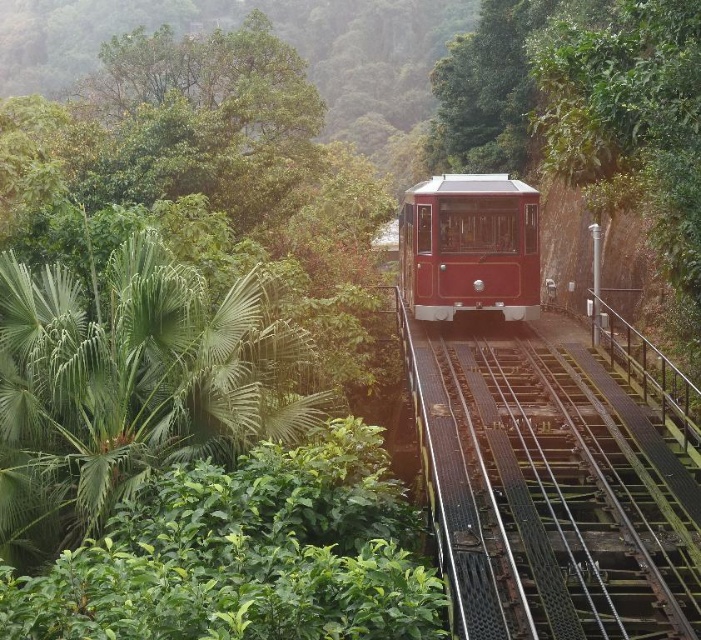
You are a railway engineer inspecting the shiny red tram at center and the black metal train track at center. Based on their sizes, which one do you think is more likely to require immediate maintenance due to wear and tear?

The black metal train track at center has a smaller size compared to the shiny red tram at center, so it might require immediate maintenance due to wear and tear because smaller tracks can experience more stress and wear under the weight of larger trams.

You are a railway inspector checking the alignment of the tracks. You notice the black metal train track at center and the shiny red tram at center. Which one has a narrower width?

The black metal train track at center is thinner than the shiny red tram at center, so the track is narrower in width.